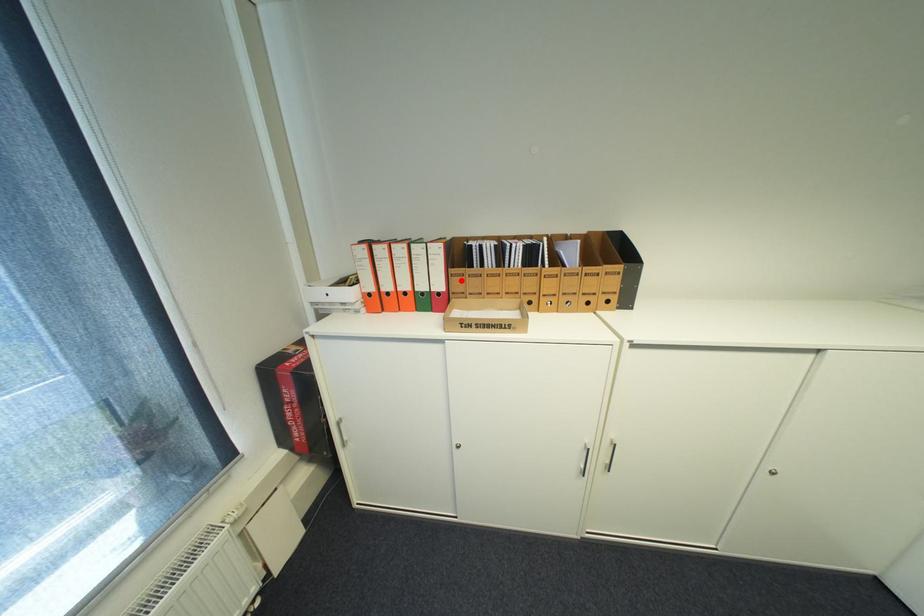
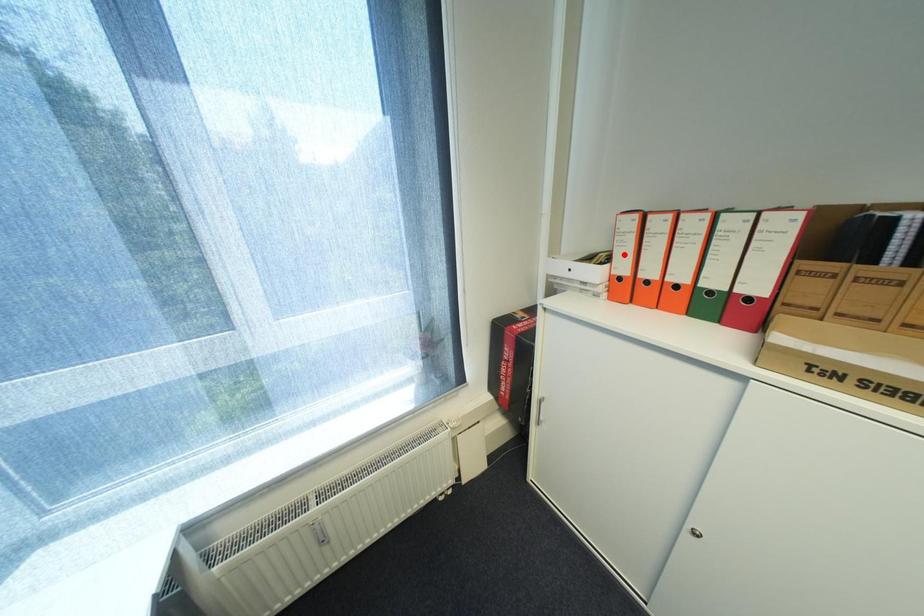
I am providing you with two images of the same scene from different viewpoints. A red point is marked on the first image and another point is marked on the second image. Are the points marked in image1 and image2 representing the same 3D position?

No